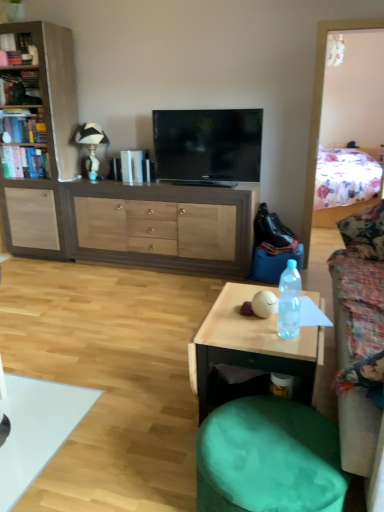
This screenshot has width=384, height=512. Find the location of `green fabric swivel chair at lower right`. green fabric swivel chair at lower right is located at coordinates (268, 458).

This screenshot has width=384, height=512. Find the location of `wooden table at center`. wooden table at center is located at coordinates (251, 346).

This screenshot has height=512, width=384. Find the location of `hardcover book at left, the 4th book viewed from the top`. hardcover book at left, the 4th book viewed from the top is located at coordinates (25, 162).

This screenshot has height=512, width=384. What do you see at coordinates (344, 184) in the screenshot? I see `floral fabric bed at upper right` at bounding box center [344, 184].

In order to face flat screen tv at center, should I rotate leftwards or rightwards?

You should look right and rotate roughly 1.699 degrees.

I want to click on green fabric swivel chair at lower right, so click(268, 458).

From a real-world perspective, between matte wood cabinet at left and brown wood cabinet at center, who is vertically lower?

brown wood cabinet at center, from a real-world perspective.

Which object is positioned more to the right, matte wood cabinet at left or brown wood cabinet at center?

brown wood cabinet at center.

Between point (63, 112) and point (181, 270), which one is positioned behind?

Positioned behind is point (63, 112).

The image size is (384, 512). I want to click on desk that is on the right side of matte wood cabinet at left, so click(160, 226).

Can you see green fabric swivel chair at lower right touching floral fabric couch at right?

No, green fabric swivel chair at lower right is not next to floral fabric couch at right.

From the image's perspective, does green fabric swivel chair at lower right appear lower than floral fabric couch at right?

Indeed, from the image's perspective, green fabric swivel chair at lower right is shown beneath floral fabric couch at right.

From a real-world perspective, who is located higher, green fabric swivel chair at lower right or floral fabric couch at right?

floral fabric couch at right.

At what (x,y) coordinates should I click in order to perform the action: click on studio couch on the right of green fabric swivel chair at lower right. Please return your answer as a coordinate pair (x, y). Looking at the image, I should click on (360, 344).

Looking at this image, considering the relative sizes of hardcover book at left, the 1th book when ordered from bottom to top, and hardcover book at upper left, which is counted as the first book, starting from the top, in the image provided, is hardcover book at left, the 1th book when ordered from bottom to top, wider than hardcover book at upper left, which is counted as the first book, starting from the top,?

Correct, the width of hardcover book at left, the 1th book when ordered from bottom to top, exceeds that of hardcover book at upper left, which is counted as the first book, starting from the top.

Between hardcover book at left, the 1th book when ordered from bottom to top, and hardcover book at upper left, which ranks as the fourth book in bottom-to-top order, which one is positioned behind?

hardcover book at left, the 1th book when ordered from bottom to top, is further from the camera.

In terms of size, does hardcover book at left, the 4th book viewed from the top, appear bigger or smaller than hardcover book at upper left, which is counted as the first book, starting from the top?

Clearly, hardcover book at left, the 4th book viewed from the top, is larger in size than hardcover book at upper left, which is counted as the first book, starting from the top.

Does matte wood cabinet at left have a greater width compared to floral fabric bed at upper right?

In fact, matte wood cabinet at left might be narrower than floral fabric bed at upper right.

From a real-world perspective, who is located lower, matte wood cabinet at left or floral fabric bed at upper right?

In real-world perspective, floral fabric bed at upper right is lower.

From the image's perspective, who appears lower, matte wood cabinet at left or floral fabric bed at upper right?

matte wood cabinet at left is shown below in the image.

Is matte wood cabinet at left inside the boundaries of floral fabric bed at upper right, or outside?

matte wood cabinet at left is not enclosed by floral fabric bed at upper right.

Is brown wood cabinet at center not near wooden table at center?

Indeed, brown wood cabinet at center is not near wooden table at center.

Considering the points (164, 253) and (215, 307), which point is behind, point (164, 253) or point (215, 307)?

The point (164, 253) is behind.

Considering the relative sizes of brown wood cabinet at center and wooden table at center in the image provided, is brown wood cabinet at center thinner than wooden table at center?

Correct, the width of brown wood cabinet at center is less than that of wooden table at center.

Considering the relative sizes of hardcover book at upper left, which is counted as the first book, starting from the top, and brown wood cabinet at center in the image provided, is hardcover book at upper left, which is counted as the first book, starting from the top, bigger than brown wood cabinet at center?

No, hardcover book at upper left, which is counted as the first book, starting from the top, is not bigger than brown wood cabinet at center.

Is hardcover book at upper left, which ranks as the fourth book in bottom-to-top order, taller or shorter than brown wood cabinet at center?

hardcover book at upper left, which ranks as the fourth book in bottom-to-top order, is shorter than brown wood cabinet at center.

Does point (36, 58) come closer to viewer compared to point (191, 264)?

That is True.

From a real-world perspective, is hardcover book at upper left, which is counted as the first book, starting from the top, positioned above or below brown wood cabinet at center?

Clearly, from a real-world perspective, hardcover book at upper left, which is counted as the first book, starting from the top, is above brown wood cabinet at center.

In terms of height, does white ceramic lamp at upper left look taller or shorter compared to floral fabric couch at right?

Clearly, white ceramic lamp at upper left is shorter compared to floral fabric couch at right.

Which object is positioned more to the right, white ceramic lamp at upper left or floral fabric couch at right?

floral fabric couch at right is more to the right.

Is point (97, 142) closer to viewer compared to point (373, 362)?

No, it is behind (373, 362).

The width and height of the screenshot is (384, 512). Identify the location of cabinetry above the brown wood cabinet at center (from the image's perspective). pyautogui.click(x=37, y=138).

This screenshot has width=384, height=512. Find the location of `studio couch that is above the green fabric swivel chair at lower right (from a real-world perspective)`. studio couch that is above the green fabric swivel chair at lower right (from a real-world perspective) is located at coordinates (360, 344).

Based on their spatial positions, is green fabric swivel chair at lower right or matte wood cabinet at left closer to wooden table at center?

green fabric swivel chair at lower right is positioned closer to the anchor wooden table at center.

Considering their positions, is floral fabric bed at upper right positioned further to flat screen tv at center than hardcover book at left, arranged as the 3th book when ordered from the bottom?

Among the two, floral fabric bed at upper right is located further to flat screen tv at center.

Looking at the image, which one is located closer to floral fabric bed at upper right, white ceramic lamp at upper left or brown wood cabinet at center?

The object closer to floral fabric bed at upper right is brown wood cabinet at center.

When comparing their distances from hardcover book at left, which is counted as the third book, starting from the top, does matte wood cabinet at left or hardcover book at left, which ranks as the 2th book in top-to-bottom order, seem further?

Based on the image, matte wood cabinet at left appears to be further to hardcover book at left, which is counted as the third book, starting from the top.

Which object lies further to the anchor point green fabric swivel chair at lower right, white ceramic lamp at upper left or flat screen tv at center?

The object further to green fabric swivel chair at lower right is white ceramic lamp at upper left.

Looking at the image, which one is located further to matte wood cabinet at left, hardcover book at upper left, which ranks as the fourth book in bottom-to-top order, or hardcover book at left, which is counted as the third book, starting from the top?

hardcover book at upper left, which ranks as the fourth book in bottom-to-top order, is further to matte wood cabinet at left.

Considering their positions, is matte wood cabinet at left positioned closer to white ceramic lamp at upper left than hardcover book at left, the 4th book viewed from the top?

hardcover book at left, the 4th book viewed from the top, lies closer to white ceramic lamp at upper left than the other object.

Considering their positions, is green fabric swivel chair at lower right positioned closer to white ceramic lamp at upper left than floral fabric couch at right?

Based on the image, floral fabric couch at right appears to be nearer to white ceramic lamp at upper left.

Identify the location of swivel chair between floral fabric couch at right and matte wood cabinet at left from front to back. Image resolution: width=384 pixels, height=512 pixels. (268, 458).

Where is `television between floral fabric couch at right and floral fabric bed at upper right from front to back`? television between floral fabric couch at right and floral fabric bed at upper right from front to back is located at coordinates (208, 145).

The image size is (384, 512). What are the coordinates of `studio couch between clear plastic bottle at center and green fabric swivel chair at lower right vertically` in the screenshot? It's located at (360, 344).

Where is `bottle between green fabric swivel chair at lower right and flat screen tv at center from front to back`? Image resolution: width=384 pixels, height=512 pixels. bottle between green fabric swivel chair at lower right and flat screen tv at center from front to back is located at coordinates (289, 301).